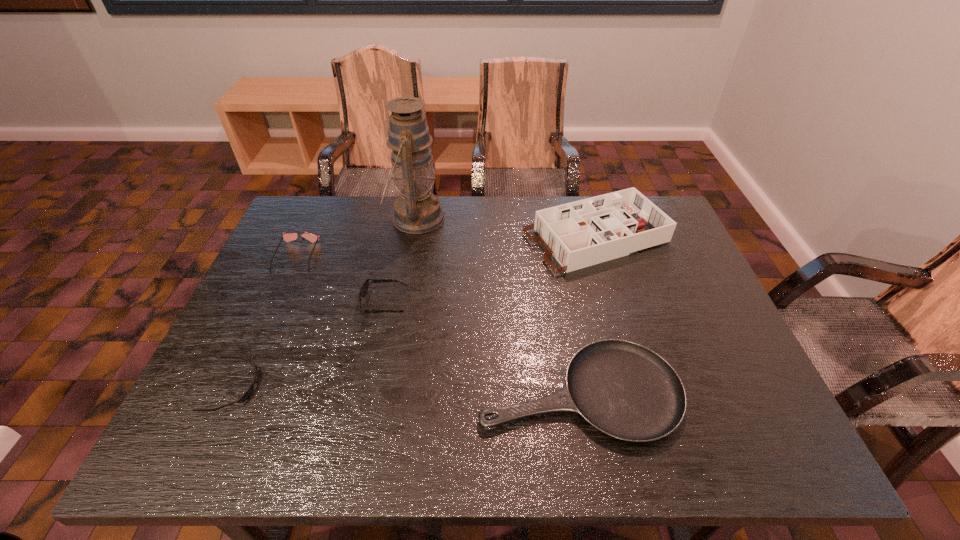
Locate an element on the screen. The image size is (960, 540). free space between the second nearest sunglasses and the dollhouse is located at coordinates (491, 271).

The height and width of the screenshot is (540, 960). Identify the location of vacant space that's between the frying pan and the farthest sunglasses. (438, 324).

Where is `vacant region between the frying pan and the nearest sunglasses`? vacant region between the frying pan and the nearest sunglasses is located at coordinates (407, 389).

You are a GUI agent. You are given a task and a screenshot of the screen. Output one action in this format:
    pyautogui.click(x=<x>, y=<y>)
    Task: Click on the empty space between the fourth farthest object and the farthest sunglasses
    The height and width of the screenshot is (540, 960).
    Given the screenshot: What is the action you would take?
    pyautogui.click(x=341, y=280)

Where is `object that ranks as the second closest to the frying pan`? This screenshot has height=540, width=960. object that ranks as the second closest to the frying pan is located at coordinates (583, 233).

Locate an element on the screen. This screenshot has width=960, height=540. object that is the fifth closest to the farthest sunglasses is located at coordinates (583, 233).

Identify which sunglasses is located as the second nearest to the nearest sunglasses. Please provide its 2D coordinates. Your answer should be formatted as a tuple, i.e. [(x, y)], where the tuple contains the x and y coordinates of a point satisfying the conditions above.

[(287, 237)]

Identify the location of sunglasses that is the closest to the nearest sunglasses. (364, 288).

Locate an element on the screen. Image resolution: width=960 pixels, height=540 pixels. vacant area in the image that satisfies the following two spatial constraints: 1. on the front side of the tallest object; 2. on the left side of the frying pan is located at coordinates pos(385,392).

This screenshot has width=960, height=540. I want to click on free location that satisfies the following two spatial constraints: 1. on the bridge of the farthest sunglasses; 2. on the front-facing side of the nearest sunglasses, so click(x=237, y=387).